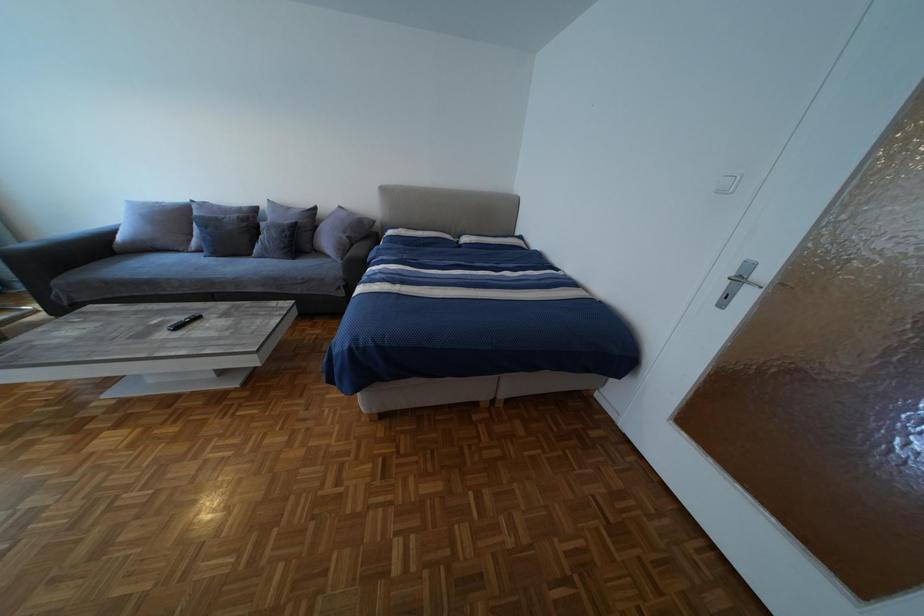
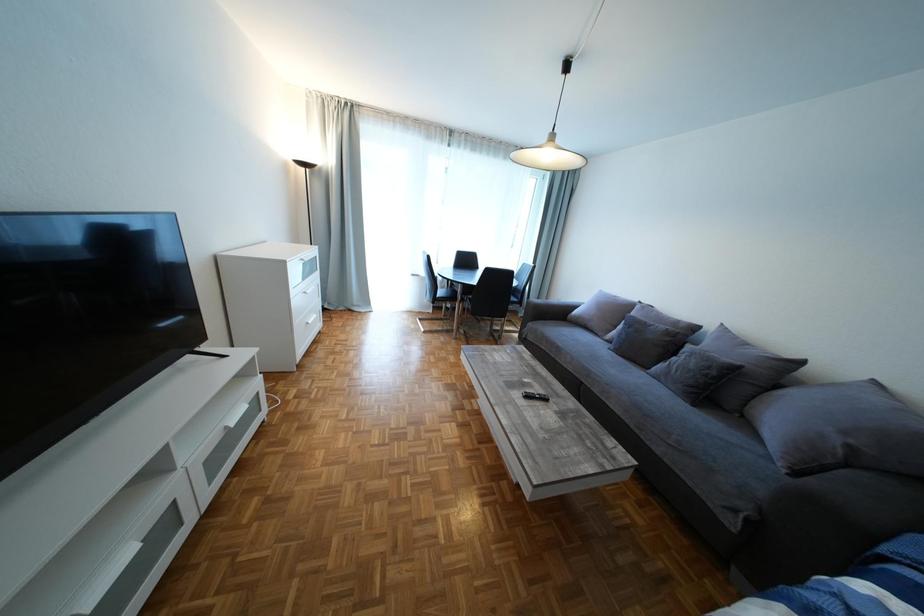
Question: Based on the continuous images, in which direction is the camera rotating? Reply with the corresponding letter.

Choices:
 (A) Left
 (B) Right
 (C) Up
 (D) Down

Answer: (A)